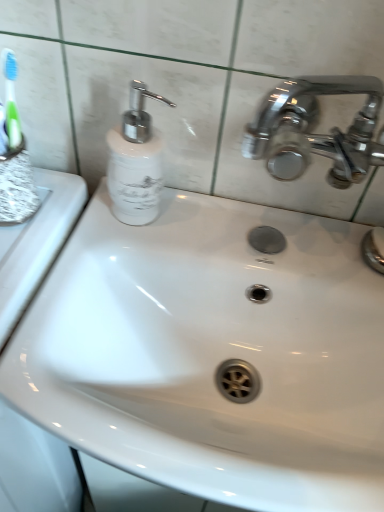
Where is `vacant space in front of white glossy soap dispenser at upper left`? This screenshot has width=384, height=512. vacant space in front of white glossy soap dispenser at upper left is located at coordinates (97, 275).